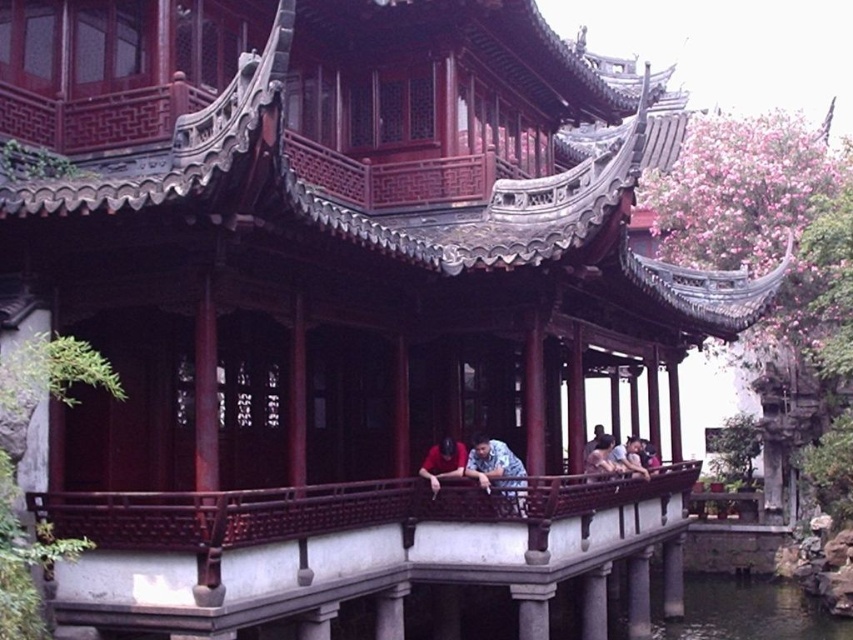
You are standing 50 feet away from the pavilion and see the light blue fabric shirt at center. Can you safely walk towards the shirt without getting too close to the pavilion?

The light blue fabric shirt at center is 75.80 feet away from the viewer. Since you are only 50 feet away from the pavilion, you are still 25.80 feet away from the shirt. Therefore, you can safely walk towards the shirt without getting too close to the pavilion.

You are standing at the entrance of the pavilion and want to locate the light blue fabric shirt at center. According to the coordinates provided, where should you look in the image?

The light blue fabric shirt at center is located at coordinates point [602,460], which is in the lower right area of the image.

You are trying to decide which shirt to wear for a photoshoot. Both the printed fabric shirt at center and the matte blue shirt at center are in front of you. Based on their widths, which one would you choose if you want a wider silhouette?

The printed fabric shirt at center might be wider than the matte blue shirt at center, so it would be the better choice for a wider silhouette.